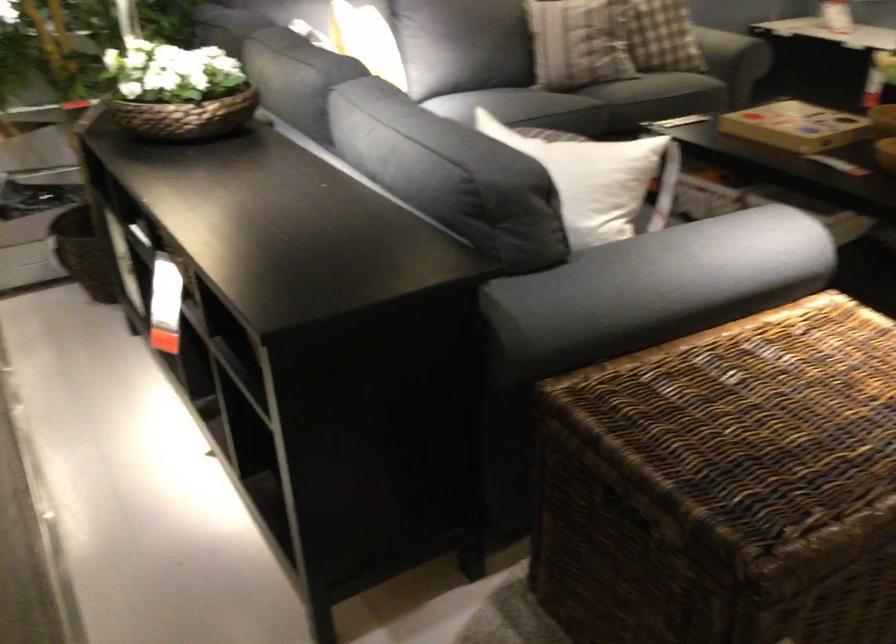
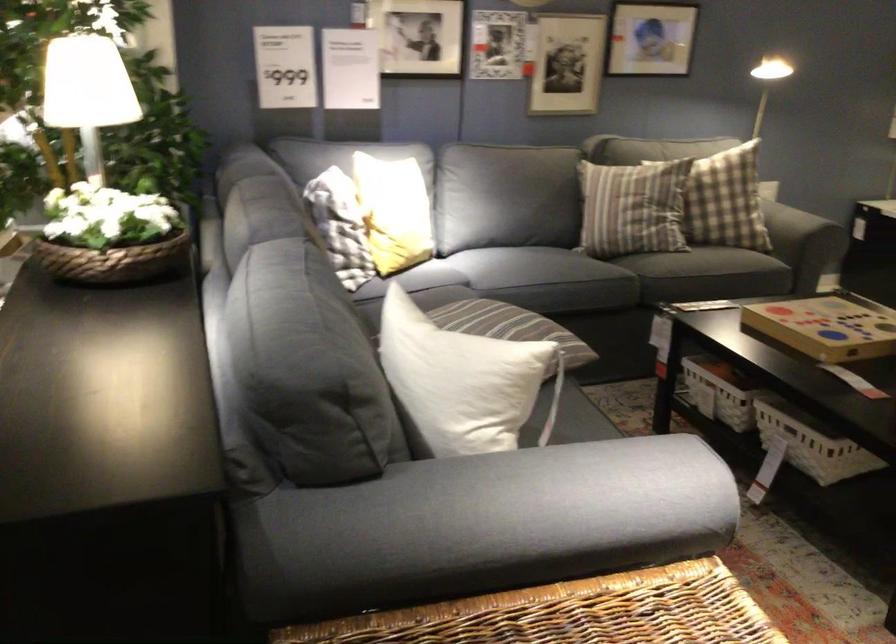
Where in the second image is the point corresponding to point (194, 93) from the first image?

(109, 236)